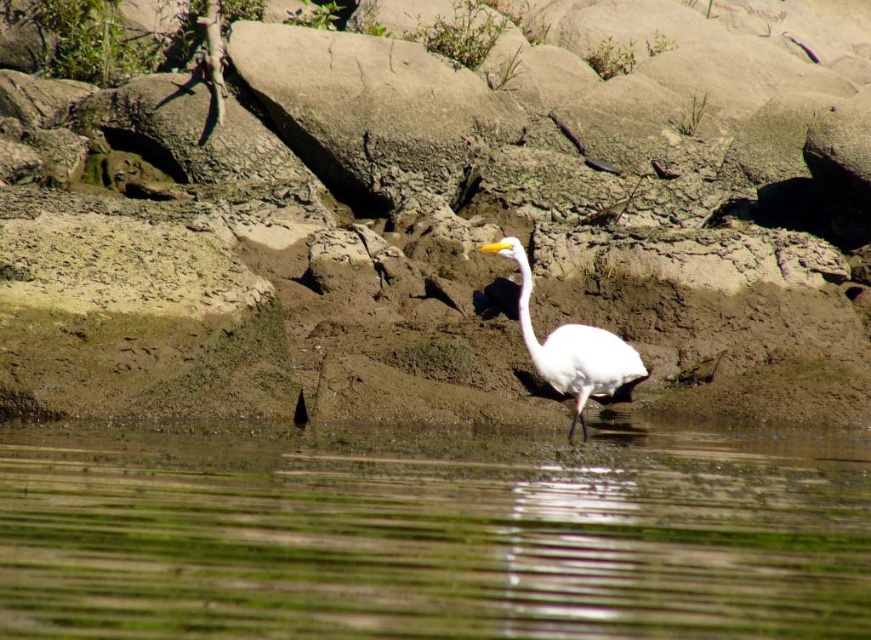
Between rough textured rock at center and green algae water at lower center, which one has less height?

With less height is green algae water at lower center.

Measure the distance from rough textured rock at center to green algae water at lower center.

9.00 meters

Which is in front, point (76, 186) or point (524, 448)?

Point (524, 448) is more forward.

The image size is (871, 640). I want to click on rough textured rock at center, so 463,200.

Does rough textured rock at center have a smaller size compared to white matte bird at center?

Actually, rough textured rock at center might be larger than white matte bird at center.

Who is higher up, rough textured rock at center or white matte bird at center?

Positioned higher is rough textured rock at center.

In order to click on rough textured rock at center in this screenshot , I will do `click(463, 200)`.

Is green algae water at lower center positioned behind white matte bird at center?

No, it is not.

Does point (117, 472) lie behind point (522, 288)?

No, it is not.

Who is more distant from viewer, (740, 458) or (559, 392)?

The point (559, 392) is behind.

You are a GUI agent. You are given a task and a screenshot of the screen. Output one action in this format:
    pyautogui.click(x=<x>, y=<y>)
    Task: Click on the green algae water at lower center
    
    Given the screenshot: What is the action you would take?
    pyautogui.click(x=431, y=536)